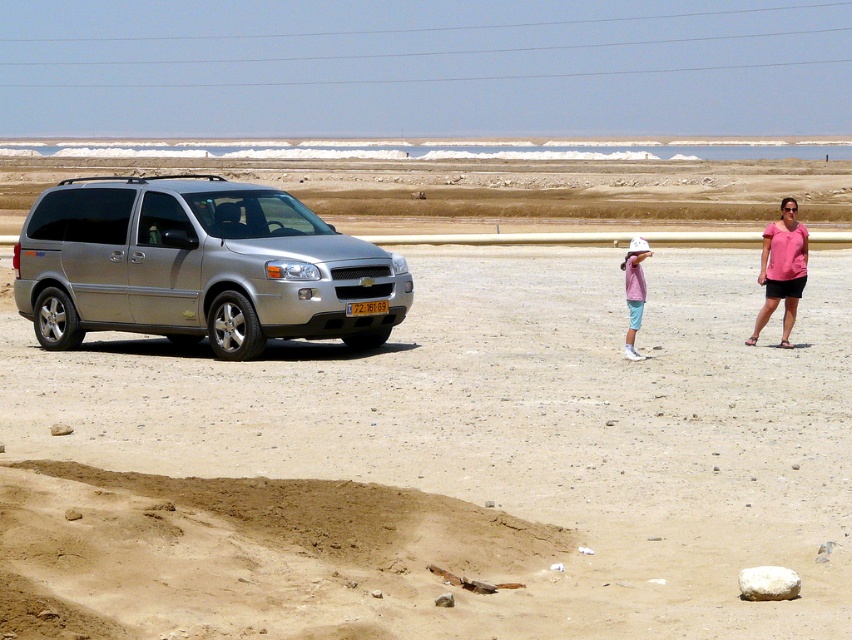
You are a delivery person who needs to park your vehicle on the sandy beige at left. The silver metallic minivan at left is already parked there. Can you park your vehicle next to it without overlapping?

The sandy beige at left is much taller than the silver metallic minivan at left, so there is enough vertical space to park next to it without overlapping.

You are standing at the point marked as point [781,269] in the image. What object is located exactly at this point?

The pink fabric shirt at right is located exactly at point [781,269].

You are planning to park your car behind the silver metallic minivan at left so that it doesn not block the view of the pink fabric shirt at right. Is the space between the minivan and the edge of the frame wide enough for your car?

The silver metallic minivan at left is narrower than the pink fabric shirt at right, but the description does not provide specific measurements about the space between the minivan and the frame edge. Therefore, it is unclear if there is sufficient space for your car.